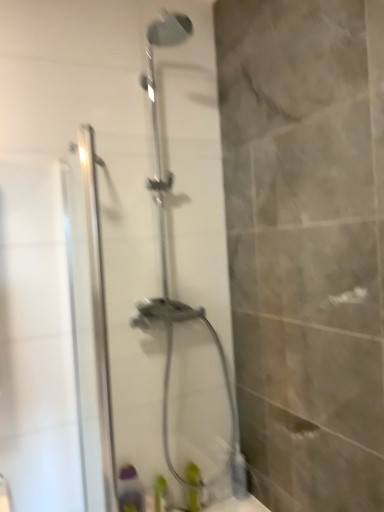
Question: Is green matte bottle at lower center, placed as the first toiletry when sorted from right to left, facing away from green plastic bottle at lower center, acting as the second toiletry starting from the right?

Choices:
 (A) yes
 (B) no

Answer: (B)

Question: Can you confirm if green matte bottle at lower center, which is the 2th toiletry from left to right, is bigger than green plastic bottle at lower center, placed as the first toiletry when sorted from left to right?

Choices:
 (A) yes
 (B) no

Answer: (B)

Question: From a real-world perspective, is green matte bottle at lower center, which is the 2th toiletry from left to right, below green plastic bottle at lower center, acting as the second toiletry starting from the right?

Choices:
 (A) no
 (B) yes

Answer: (A)

Question: Does green matte bottle at lower center, which is the 2th toiletry from left to right, contain green plastic bottle at lower center, placed as the first toiletry when sorted from left to right?

Choices:
 (A) no
 (B) yes

Answer: (A)

Question: Can you confirm if green matte bottle at lower center, placed as the first toiletry when sorted from right to left, is shorter than green plastic bottle at lower center, acting as the second toiletry starting from the right?

Choices:
 (A) no
 (B) yes

Answer: (A)

Question: Based on their sizes in the image, would you say green plastic bottle at lower center, placed as the first toiletry when sorted from left to right, is bigger or smaller than green matte bottle at lower center, placed as the first toiletry when sorted from right to left?

Choices:
 (A) small
 (B) big

Answer: (B)

Question: In terms of width, does green plastic bottle at lower center, acting as the second toiletry starting from the right, look wider or thinner when compared to green matte bottle at lower center, placed as the first toiletry when sorted from right to left?

Choices:
 (A) wide
 (B) thin

Answer: (A)

Question: Is green plastic bottle at lower center, acting as the second toiletry starting from the right, spatially inside green matte bottle at lower center, which is the 2th toiletry from left to right, or outside of it?

Choices:
 (A) inside
 (B) outside

Answer: (B)

Question: From a real-world perspective, is green plastic bottle at lower center, acting as the second toiletry starting from the right, physically located above or below green matte bottle at lower center, placed as the first toiletry when sorted from right to left?

Choices:
 (A) above
 (B) below

Answer: (B)

Question: Considering the positions of point (195, 481) and point (97, 347), is point (195, 481) closer or farther from the camera than point (97, 347)?

Choices:
 (A) farther
 (B) closer

Answer: (A)

Question: Looking at the image, does green matte bottle at lower center, placed as the first toiletry when sorted from right to left, seem bigger or smaller compared to clear glass shower door at center?

Choices:
 (A) big
 (B) small

Answer: (B)

Question: From a real-world perspective, is green matte bottle at lower center, placed as the first toiletry when sorted from right to left, positioned above or below clear glass shower door at center?

Choices:
 (A) above
 (B) below

Answer: (B)

Question: Is green matte bottle at lower center, which is the 2th toiletry from left to right, taller or shorter than clear glass shower door at center?

Choices:
 (A) short
 (B) tall

Answer: (A)

Question: Is point (87, 138) positioned closer to the camera than point (188, 481)?

Choices:
 (A) closer
 (B) farther

Answer: (A)

Question: Considering their positions, is clear glass shower door at center located in front of or behind green matte bottle at lower center, which is the 2th toiletry from left to right?

Choices:
 (A) behind
 (B) front

Answer: (B)